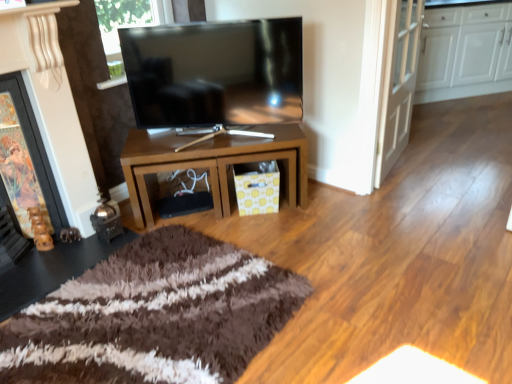
This screenshot has width=512, height=384. What do you see at coordinates (212, 163) in the screenshot?
I see `brown glossy table at center` at bounding box center [212, 163].

Measure the distance between matte black tv at center and camera.

matte black tv at center is 6.85 feet from camera.

Find the location of a particular element. This screenshot has width=512, height=384. white glossy cabinets at upper right is located at coordinates (465, 52).

I want to click on white glossy door at upper right, so click(x=397, y=82).

What do you see at coordinates (35, 148) in the screenshot? I see `wooden fireplace at left` at bounding box center [35, 148].

I want to click on brown glossy table at center, so click(x=212, y=163).

Could you tell me if wooden fireplace at left is turned towards white glossy cabinets at upper right?

No, wooden fireplace at left is not turned towards white glossy cabinets at upper right.

From their relative heights in the image, would you say wooden fireplace at left is taller or shorter than white glossy cabinets at upper right?

In the image, wooden fireplace at left appears to be shorter than white glossy cabinets at upper right.

Is wooden fireplace at left not close to white glossy cabinets at upper right?

Yes, wooden fireplace at left and white glossy cabinets at upper right are located far from each other.

Between wooden fireplace at left and white glossy cabinets at upper right, which one is positioned in front?

Positioned in front is wooden fireplace at left.

Is matte black tv at center bigger or smaller than brown glossy table at center?

In the image, matte black tv at center appears to be smaller than brown glossy table at center.

Does matte black tv at center have a greater width compared to brown glossy table at center?

No.

How different are the orientations of matte black tv at center and brown glossy table at center in degrees?

The facing directions of matte black tv at center and brown glossy table at center are 16.5 degrees apart.

Is matte black tv at center next to brown glossy table at center?

matte black tv at center and brown glossy table at center are not in contact.

Is point (429, 33) positioned behind point (223, 47)?

Yes, it is.

Between white glossy cabinets at upper right and matte black tv at center, which one appears on the left side from the viewer's perspective?

matte black tv at center is more to the left.

How far apart are white glossy cabinets at upper right and matte black tv at center?

white glossy cabinets at upper right is 8.04 feet away from matte black tv at center.

Can matte black tv at center be found inside white glossy cabinets at upper right?

No, matte black tv at center is located outside of white glossy cabinets at upper right.

Between wooden fireplace at left and matte black tv at center, which one has less height?

matte black tv at center is shorter.

Between wooden fireplace at left and matte black tv at center, which one has smaller width?

Thinner between the two is matte black tv at center.

Is wooden fireplace at left positioned before matte black tv at center?

Yes, wooden fireplace at left is closer to the camera.

Is wooden fireplace at left not within matte black tv at center?

That's correct, wooden fireplace at left is outside of matte black tv at center.

Considering the sizes of matte black tv at center and white glossy cabinets at upper right in the image, is matte black tv at center bigger or smaller than white glossy cabinets at upper right?

In the image, matte black tv at center appears to be smaller than white glossy cabinets at upper right.

Which is closer to the camera, (292, 102) or (493, 55)?

Point (292, 102).

Between matte black tv at center and white glossy cabinets at upper right, which one has larger width?

Wider between the two is white glossy cabinets at upper right.

Considering the relative positions of matte black tv at center and white glossy cabinets at upper right in the image provided, is matte black tv at center to the right of white glossy cabinets at upper right from the viewer's perspective?

In fact, matte black tv at center is to the left of white glossy cabinets at upper right.

Which point is more forward, (395, 62) or (164, 138)?

Point (164, 138)

Which is behind, white glossy door at upper right or brown glossy table at center?

Positioned behind is brown glossy table at center.

Is point (162, 153) farther from viewer compared to point (280, 119)?

No, (162, 153) is in front of (280, 119).

How different are the orientations of brown glossy table at center and matte black tv at center in degrees?

brown glossy table at center and matte black tv at center are facing 16.5 degrees away from each other.

From the picture: Can matte black tv at center be found inside brown glossy table at center?

No, brown glossy table at center does not contain matte black tv at center.

From the image's perspective, which is below, brown glossy table at center or matte black tv at center?

brown glossy table at center is shown below in the image.

This screenshot has width=512, height=384. In order to click on cabinetry above the wooden fireplace at left (from the image's perspective) in this screenshot , I will do `click(465, 52)`.

The height and width of the screenshot is (384, 512). In order to click on table on the right of matte black tv at center in this screenshot , I will do `click(212, 163)`.

When comparing their distances from white glossy cabinets at upper right, does white glossy door at upper right or wooden fireplace at left seem further?

wooden fireplace at left.

Considering their positions, is white glossy cabinets at upper right positioned closer to matte black tv at center than white glossy door at upper right?

The object closer to matte black tv at center is white glossy door at upper right.

Considering their positions, is white glossy cabinets at upper right positioned further to wooden fireplace at left than matte black tv at center?

white glossy cabinets at upper right is further to wooden fireplace at left.

From the image, which object appears to be farther from matte black tv at center, wooden fireplace at left or brown glossy table at center?

The object further to matte black tv at center is wooden fireplace at left.

Considering their positions, is brown glossy table at center positioned further to white glossy cabinets at upper right than wooden fireplace at left?

Among the two, wooden fireplace at left is located further to white glossy cabinets at upper right.

Considering their positions, is brown glossy table at center positioned further to wooden fireplace at left than matte black tv at center?

Based on the image, matte black tv at center appears to be further to wooden fireplace at left.

Which object lies further to the anchor point white glossy door at upper right, matte black tv at center or brown glossy table at center?

The object further to white glossy door at upper right is brown glossy table at center.

When comparing their distances from white glossy cabinets at upper right, does brown glossy table at center or white glossy door at upper right seem further?

Among the two, brown glossy table at center is located further to white glossy cabinets at upper right.

Where is `door between brown glossy table at center and white glossy cabinets at upper right from left to right`? This screenshot has height=384, width=512. door between brown glossy table at center and white glossy cabinets at upper right from left to right is located at coordinates (397, 82).

I want to click on table between wooden fireplace at left and white glossy cabinets at upper right in the horizontal direction, so click(x=212, y=163).

Locate an element on the screen. television between wooden fireplace at left and white glossy cabinets at upper right is located at coordinates (215, 74).

This screenshot has width=512, height=384. Identify the location of table between matte black tv at center and white glossy door at upper right. (212, 163).